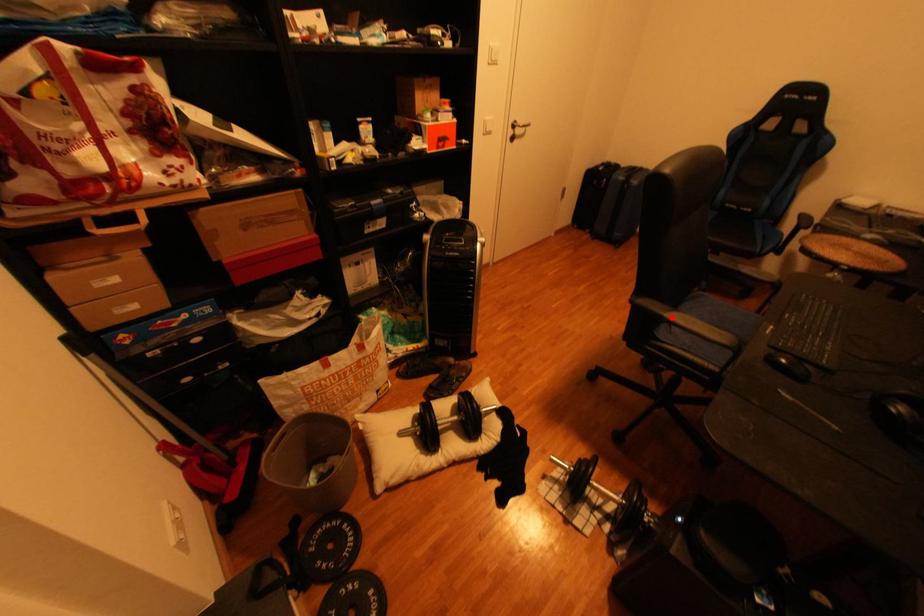
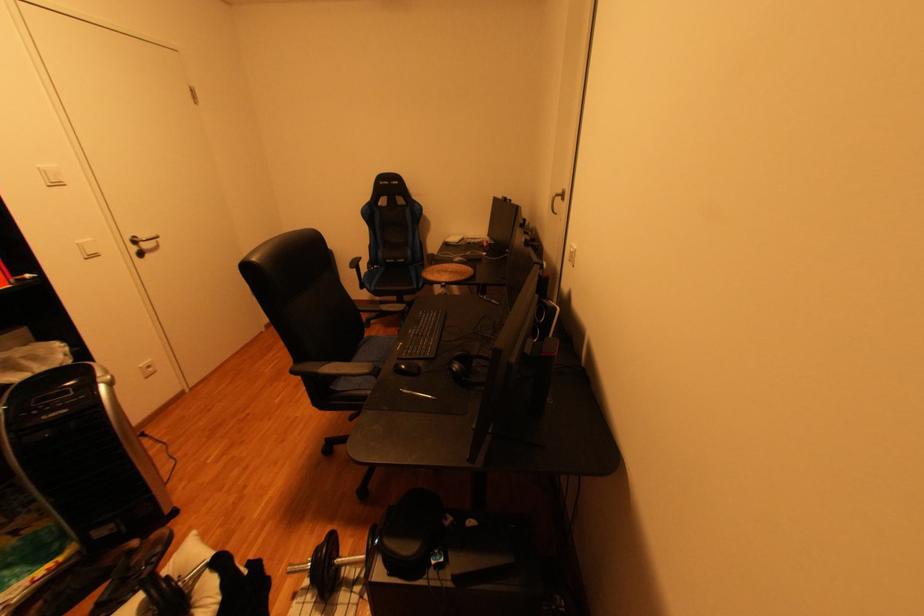
Question: I am providing you with two images of the same scene from different viewpoints. A red point is marked on the first image. Can you still see the location of the red point in image 2?

Choices:
 (A) Yes
 (B) No

Answer: (A)